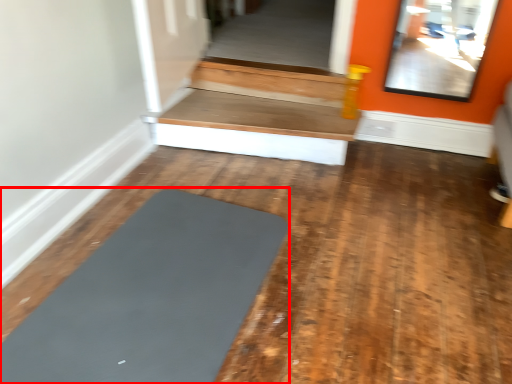
Question: From the image's perspective, where is yoga (annotated by the red box) located in relation to stairwell in the image?

Choices:
 (A) below
 (B) above

Answer: (A)